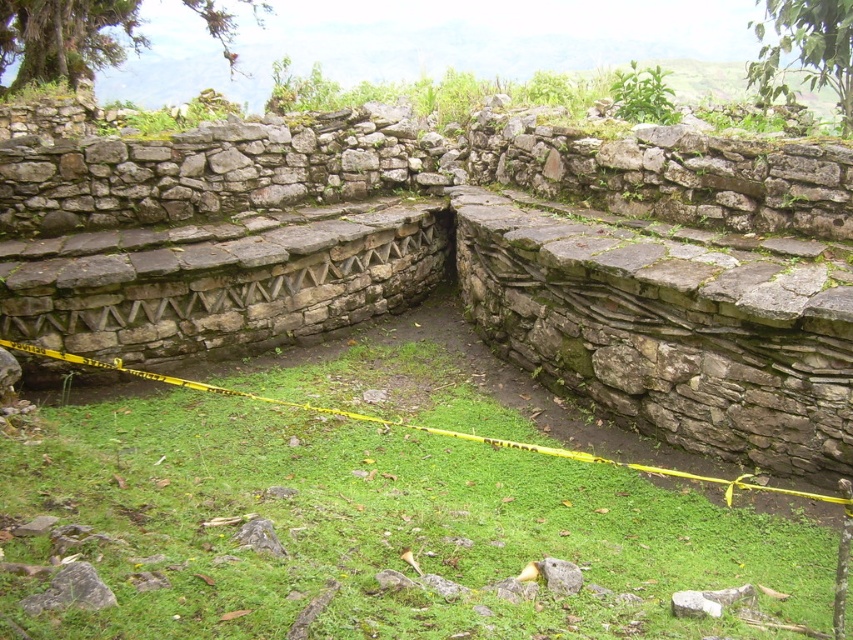
Is natural stone wall at center closer to camera compared to green grass at center?

No, natural stone wall at center is behind green grass at center.

Who is higher up, natural stone wall at center or green grass at center?

natural stone wall at center

This screenshot has height=640, width=853. Identify the location of natural stone wall at center. (462, 260).